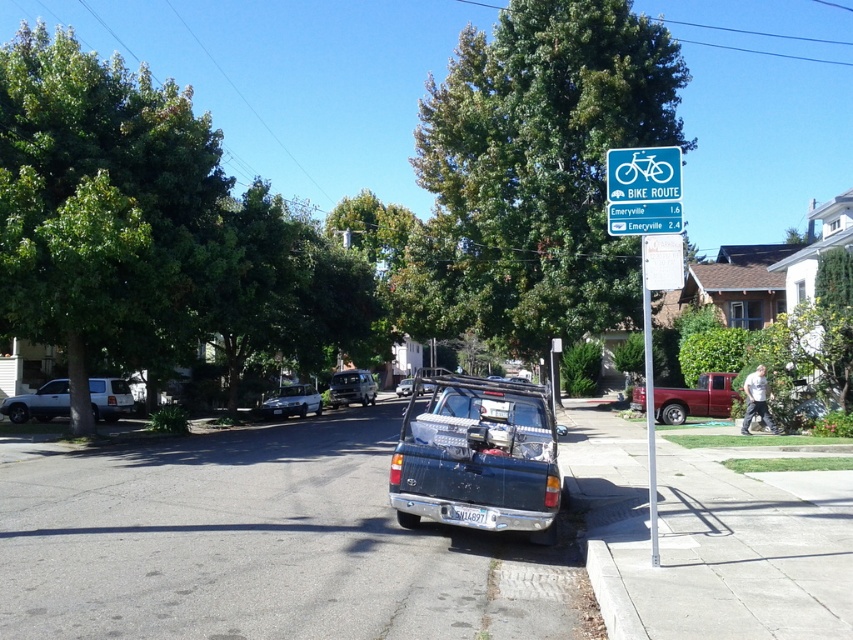
Can you confirm if matte red pickup truck at center-right is wider than white plastic license plate at center?

Correct, the width of matte red pickup truck at center-right exceeds that of white plastic license plate at center.

Between matte red pickup truck at center-right and white plastic license plate at center, which one appears on the right side from the viewer's perspective?

matte red pickup truck at center-right is more to the right.

Is point (717, 412) in front of point (463, 513)?

That is False.

Find the location of a particular element. The width and height of the screenshot is (853, 640). matte red pickup truck at center-right is located at coordinates (695, 397).

Does green leafy tree at upper center have a larger size compared to shiny silver suv at center?

Yes, green leafy tree at upper center is bigger than shiny silver suv at center.

Which is below, green leafy tree at upper center or shiny silver suv at center?

shiny silver suv at center

Find the location of a particular element. green leafy tree at upper center is located at coordinates (538, 170).

Is metallic silver pole at right taller than satin silver sedan at center?

Indeed, metallic silver pole at right has a greater height compared to satin silver sedan at center.

Describe the element at coordinates (648, 408) in the screenshot. This screenshot has width=853, height=640. I see `metallic silver pole at right` at that location.

Who is more distant from viewer, (650,321) or (320,396)?

Positioned behind is point (320,396).

Where is `metallic silver pole at right`? The width and height of the screenshot is (853, 640). metallic silver pole at right is located at coordinates (648, 408).